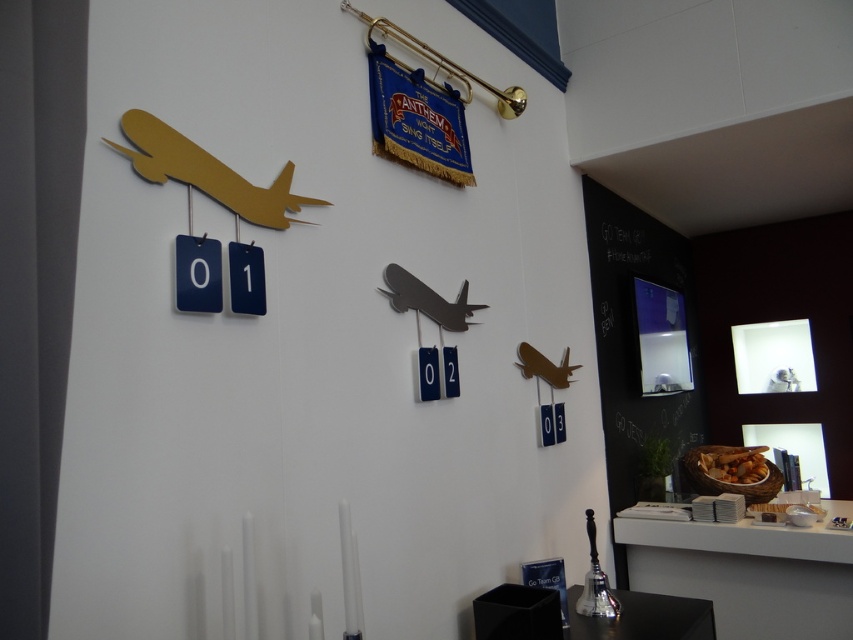
Is gold matte airplane at upper left smaller than metallic gold airplane at center?

No.

Who is more distant from viewer, [282,212] or [535,349]?

The point [535,349] is behind.

Measure the distance between gold matte airplane at upper left and camera.

gold matte airplane at upper left is 1.07 meters away from camera.

Where is `gold matte airplane at upper left`? This screenshot has width=853, height=640. gold matte airplane at upper left is located at coordinates (206, 172).

Is gold matte airplane at upper left bigger than matte black airplane at center?

Yes.

Between gold matte airplane at upper left and matte black airplane at center, which one appears on the right side from the viewer's perspective?

matte black airplane at center

What are the coordinates of `gold matte airplane at upper left` in the screenshot? It's located at (206, 172).

Image resolution: width=853 pixels, height=640 pixels. What are the coordinates of `gold matte airplane at upper left` in the screenshot? It's located at (206, 172).

Does matte black airplane at center have a smaller size compared to metallic gold airplane at center?

No, matte black airplane at center is not smaller than metallic gold airplane at center.

Does matte black airplane at center have a greater height compared to metallic gold airplane at center?

No.

What do you see at coordinates (426, 300) in the screenshot? The height and width of the screenshot is (640, 853). I see `matte black airplane at center` at bounding box center [426, 300].

This screenshot has height=640, width=853. Identify the location of matte black airplane at center. (426, 300).